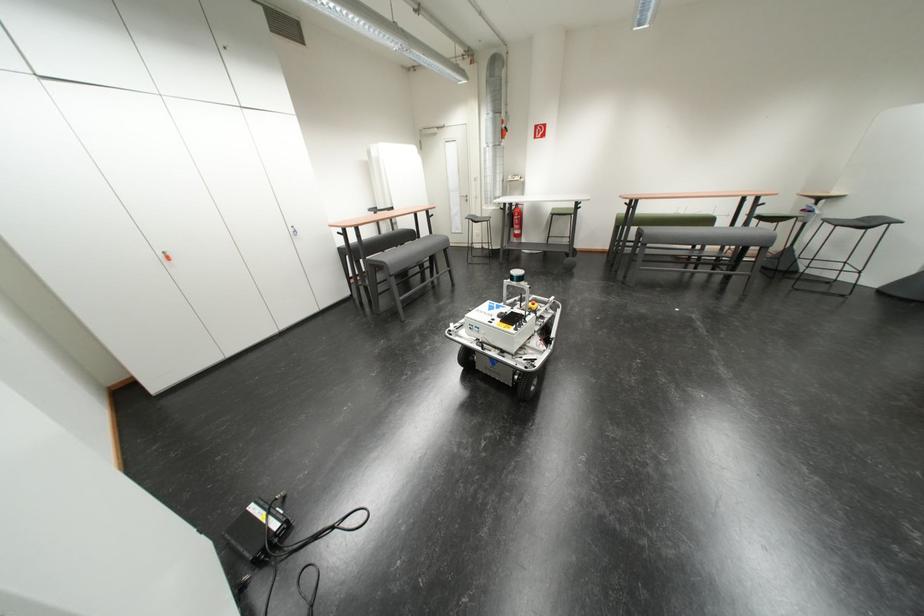
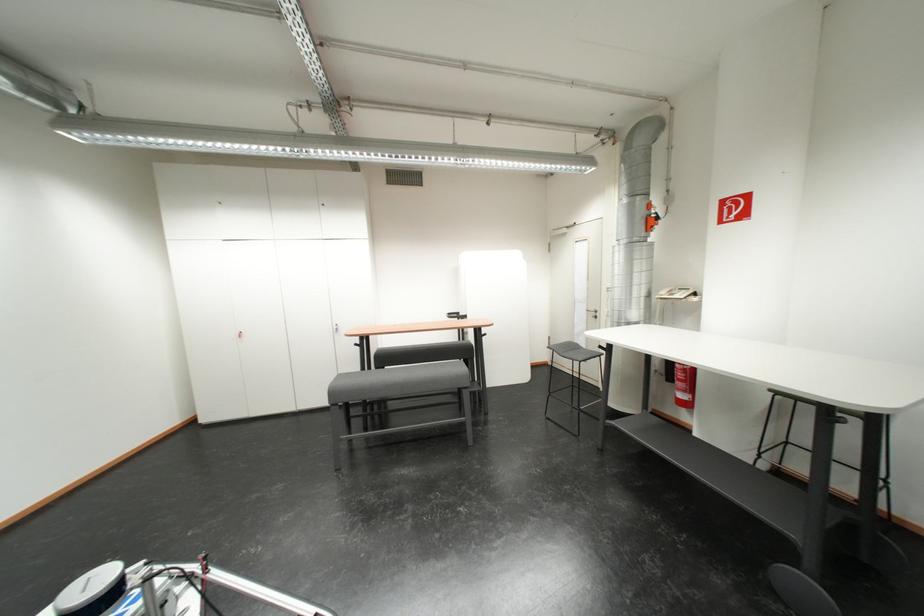
Find the pixel in the second image that matches (512,134) in the first image.

(654, 224)